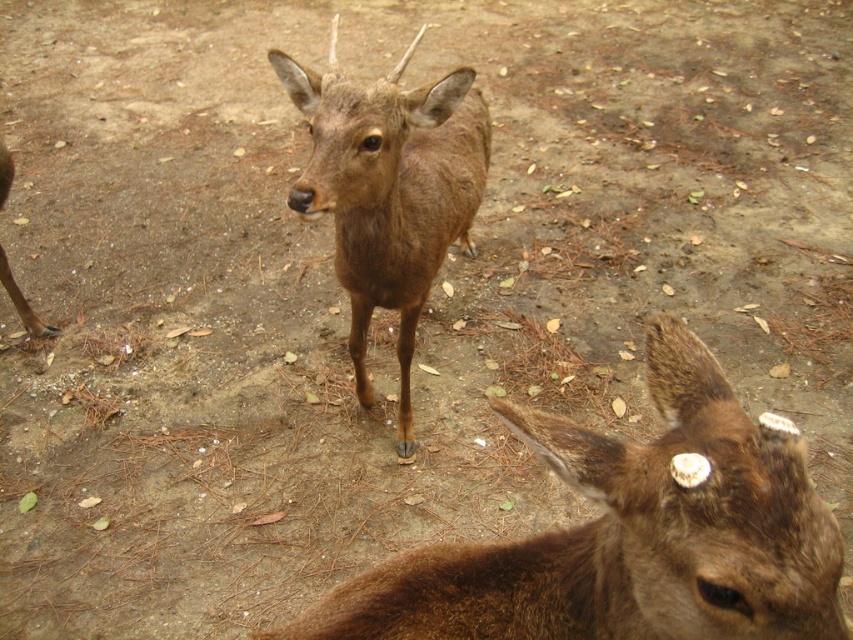
You are standing in a forest and see the brown furry deer at center. If you want to estimate its position relative to you, what are the coordinates of the deer in the image?

The coordinates of the brown furry deer at center are at point (630, 534).